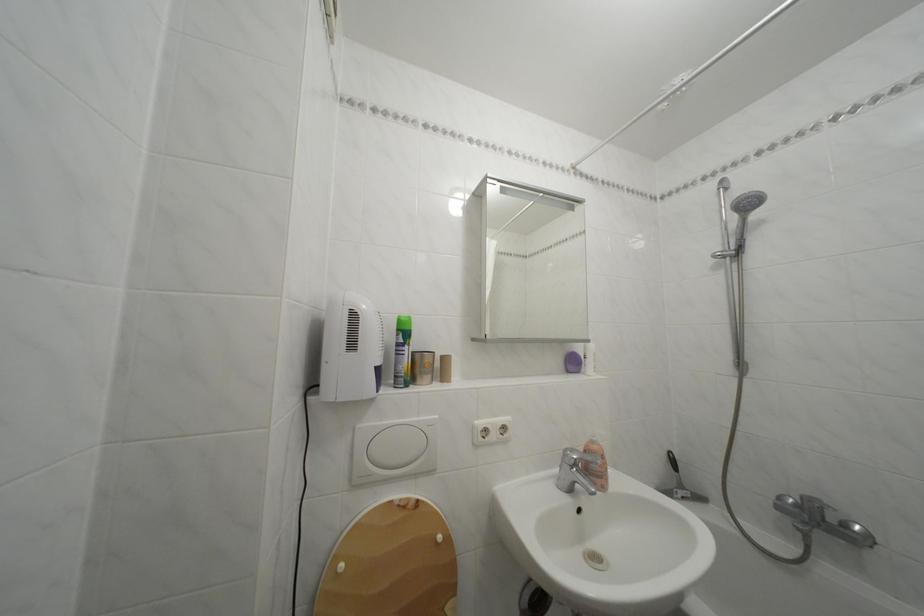
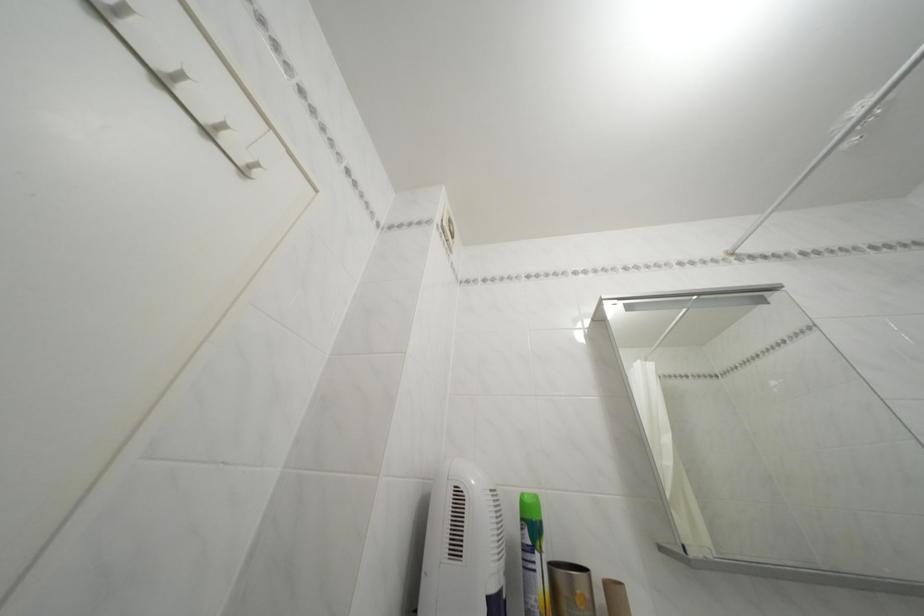
Find the pixel in the second image that matches [416,354] in the first image.

(545, 562)